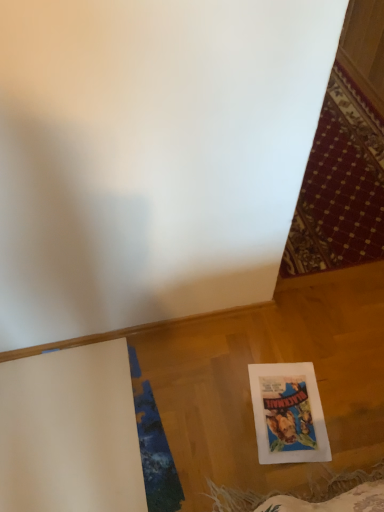
Locate an element on the screen. This screenshot has width=384, height=512. white paper at lower right is located at coordinates (288, 414).

Image resolution: width=384 pixels, height=512 pixels. Describe the element at coordinates (288, 414) in the screenshot. I see `white paper at lower right` at that location.

You are a GUI agent. You are given a task and a screenshot of the screen. Output one action in this format:
    pyautogui.click(x=<x>, y=<y>)
    Task: Click on the white paper at lower right
    The height and width of the screenshot is (512, 384).
    Given the screenshot: What is the action you would take?
    pyautogui.click(x=288, y=414)